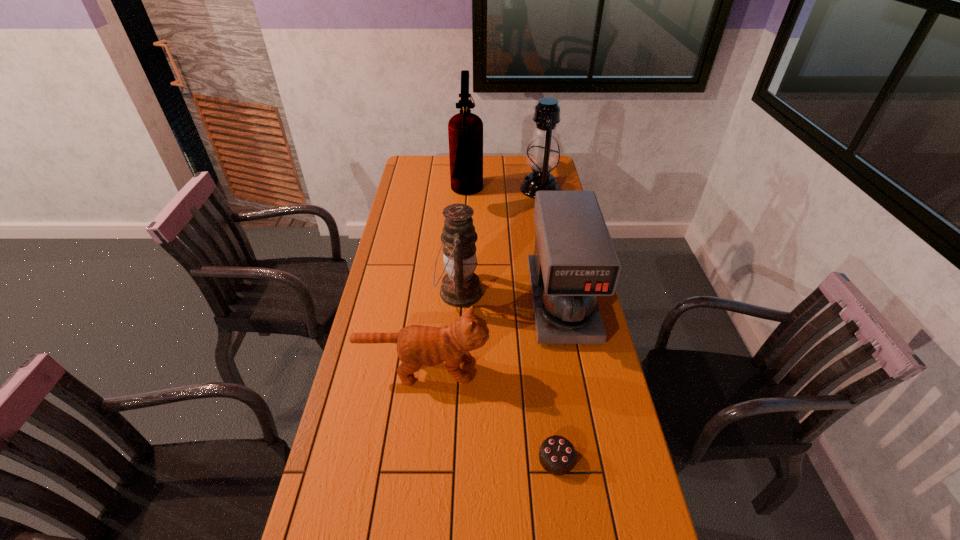
You are a GUI agent. You are given a task and a screenshot of the screen. Output one action in this format:
    pyautogui.click(x=<x>, y=<y>)
    Task: Click on the free space between the second nearest object and the right lantern
    The image size is (960, 540).
    Given the screenshot: What is the action you would take?
    pyautogui.click(x=481, y=279)

Identify the location of the second closest object to the coffee maker. Image resolution: width=960 pixels, height=540 pixels. (461, 287).

Where is `the second closest object to the coffee maker`? The width and height of the screenshot is (960, 540). the second closest object to the coffee maker is located at coordinates (461, 287).

Find the location of a particular element. The height and width of the screenshot is (540, 960). free point that satisfies the following two spatial constraints: 1. on the face of the fifth tallest object; 2. on the right side of the chocolate cake is located at coordinates (413, 458).

At what (x,y) coordinates should I click in order to perform the action: click on vacant region that satisfies the following two spatial constraints: 1. at the nozzle of the tallest object; 2. on the left side of the chocolate cake. Please return your answer as a coordinate pair (x, y). The height and width of the screenshot is (540, 960). Looking at the image, I should click on (455, 458).

Locate an element on the screen. The image size is (960, 540). free spot that satisfies the following two spatial constraints: 1. on the front side of the nearer lantern; 2. on the face of the second shortest object is located at coordinates (455, 369).